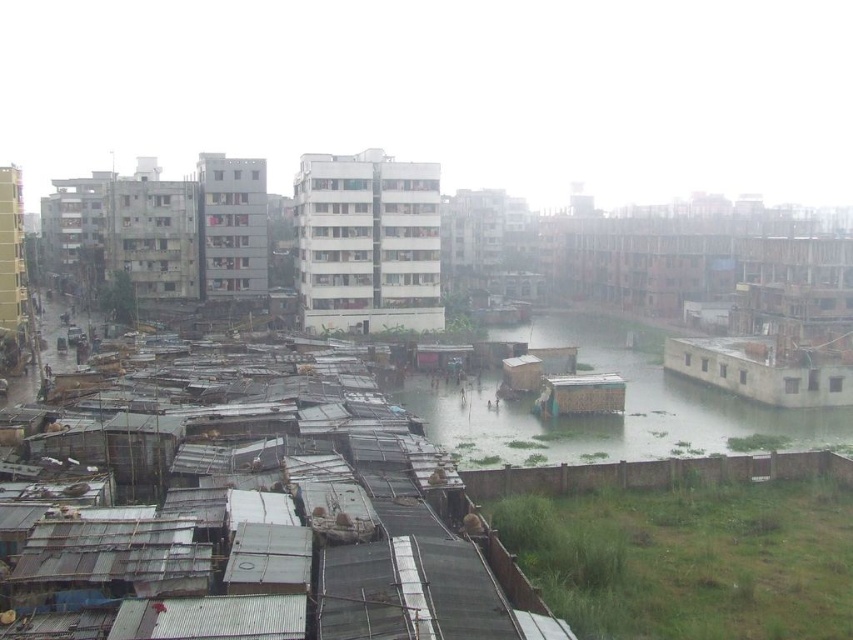
Between gray concrete building at center and concrete wall at right, which one is positioned lower?

concrete wall at right

Who is shorter, gray concrete building at center or concrete wall at right?

concrete wall at right

Which is behind, point (239, 288) or point (759, 368)?

Positioned behind is point (239, 288).

The width and height of the screenshot is (853, 640). What are the coordinates of `gray concrete building at center` in the screenshot? It's located at (231, 225).

Between white matte building at center and gray concrete building at center, which one appears on the right side from the viewer's perspective?

From the viewer's perspective, white matte building at center appears more on the right side.

Can you confirm if white matte building at center is positioned to the right of gray concrete building at center?

Indeed, white matte building at center is positioned on the right side of gray concrete building at center.

Who is more distant from viewer, (341, 266) or (225, 272)?

The point (225, 272) is more distant.

Locate an element on the screen. The image size is (853, 640). white matte building at center is located at coordinates (367, 243).

Measure the distance from green grassy river at center to gray concrete building at center.

The distance of green grassy river at center from gray concrete building at center is 42.15 meters.

This screenshot has height=640, width=853. Describe the element at coordinates (607, 416) in the screenshot. I see `green grassy river at center` at that location.

The image size is (853, 640). Identify the location of green grassy river at center. (607, 416).